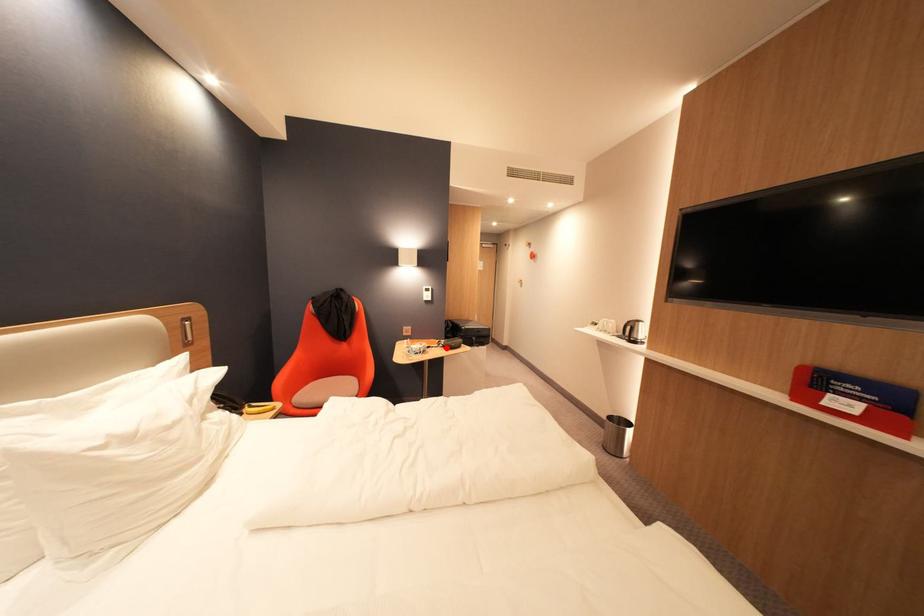
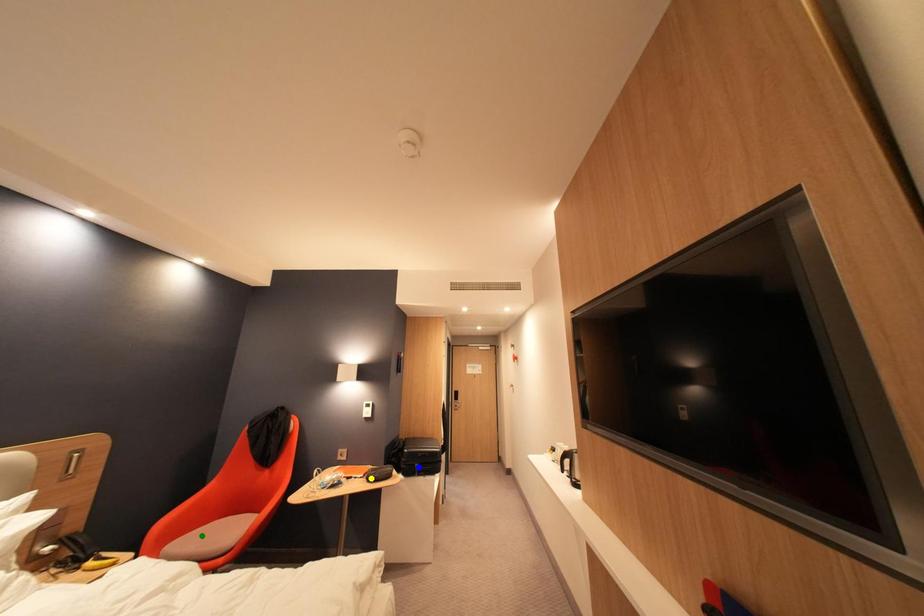
Question: I am providing you with two images of the same scene from different viewpoints. A red point is marked on the first image. You are given multiple points on the second image. Which mark in image 2 goes with the point in image 1?

Choices:
 (A) green point
 (B) blue point
 (C) yellow point

Answer: (C)